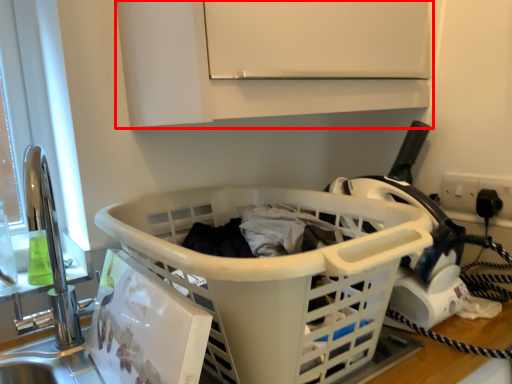
Question: In this image, where is cabinetry (annotated by the red box) located relative to basket?

Choices:
 (A) left
 (B) right

Answer: (B)